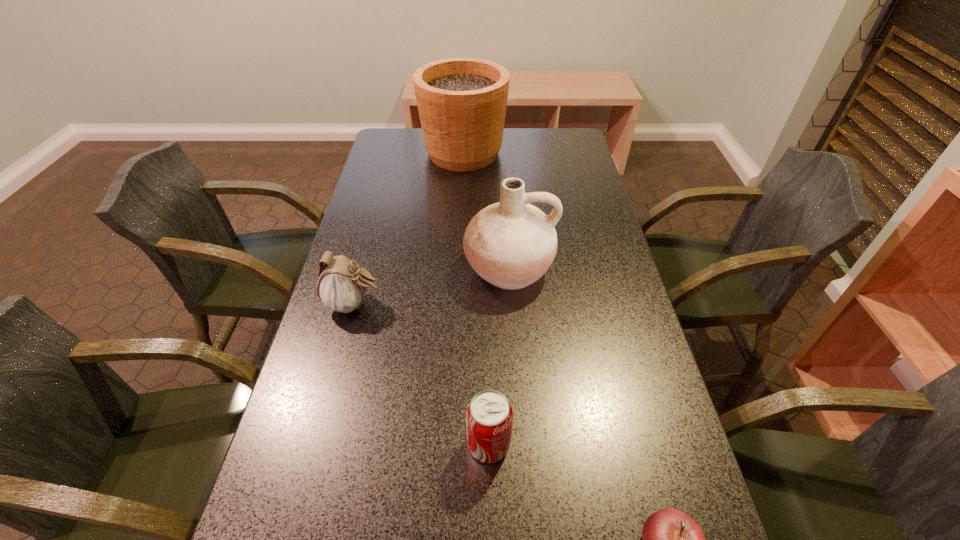
Locate an element on the screen. flowerpot is located at coordinates (462, 102).

This screenshot has width=960, height=540. Find the location of `pottery`. pottery is located at coordinates (511, 244).

Locate an element on the screen. pouch is located at coordinates (342, 286).

At what (x,y) coordinates should I click in order to perform the action: click on soda. Please return your answer as a coordinate pair (x, y). Looking at the image, I should click on (489, 416).

Image resolution: width=960 pixels, height=540 pixels. I want to click on vacant area situated on the front of the farthest object, so click(459, 251).

You are a GUI agent. You are given a task and a screenshot of the screen. Output one action in this format:
    pyautogui.click(x=<x>, y=<y>)
    Task: Click on the free region located to pour from the handle of the pottery
    
    Given the screenshot: What is the action you would take?
    pos(515,359)

This screenshot has height=540, width=960. In order to click on free point located on the front-facing side of the leftmost object in this screenshot , I will do `click(420, 304)`.

Identify the location of free space located 0.240m on the left of the fourth farthest object. 341,444.

At what (x,y) coordinates should I click in order to perform the action: click on object present at the far edge. Please return your answer as a coordinate pair (x, y). Looking at the image, I should click on (462, 102).

You are a GUI agent. You are given a task and a screenshot of the screen. Output one action in this format:
    pyautogui.click(x=<x>, y=<y>)
    Task: Click on the flowerpot situated at the left edge
    This screenshot has width=960, height=540.
    Given the screenshot: What is the action you would take?
    pyautogui.click(x=462, y=102)